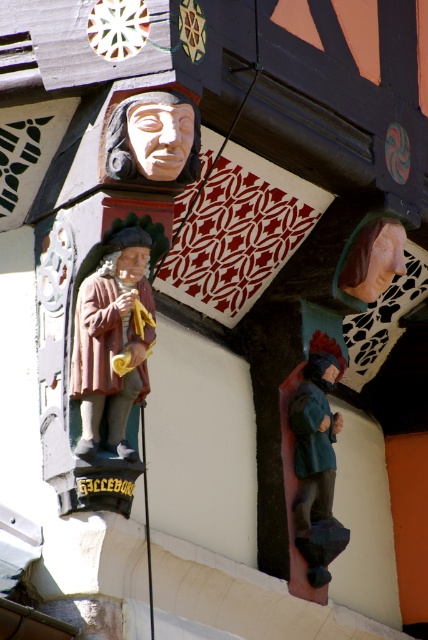
What is the significance of the point marked at coordinates (154, 140) in the image?

The point marked at coordinates (154, 140) indicates the location of the wooden carving at upper center.

You are an architect designing a new traditional building and want to place both the wooden statue at left and the wooden figure at lower right on the facade. Given their sizes, which one should you place on the side with more space?

The wooden statue at left is wider than the wooden figure at lower right, so you should place the wooden statue at left on the side with more space.

You are an architect examining the building and want to install a small light above the point that is closer to the viewer. Which point should you choose between point (110, 436) and point (315, 356)?

Point (110, 436) is in front of point (315, 356), so you should choose point (110, 436) to install the light above it since it is closer to the viewer.